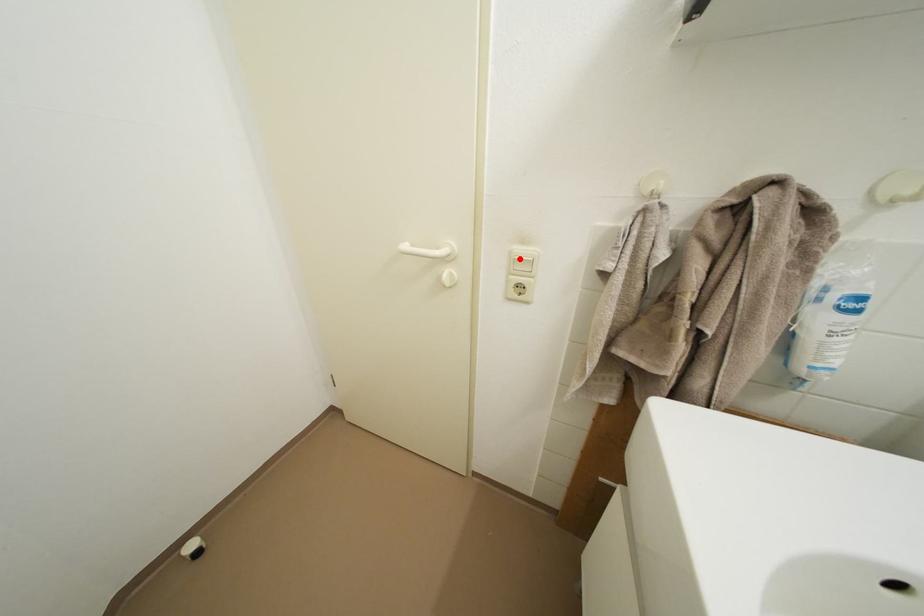
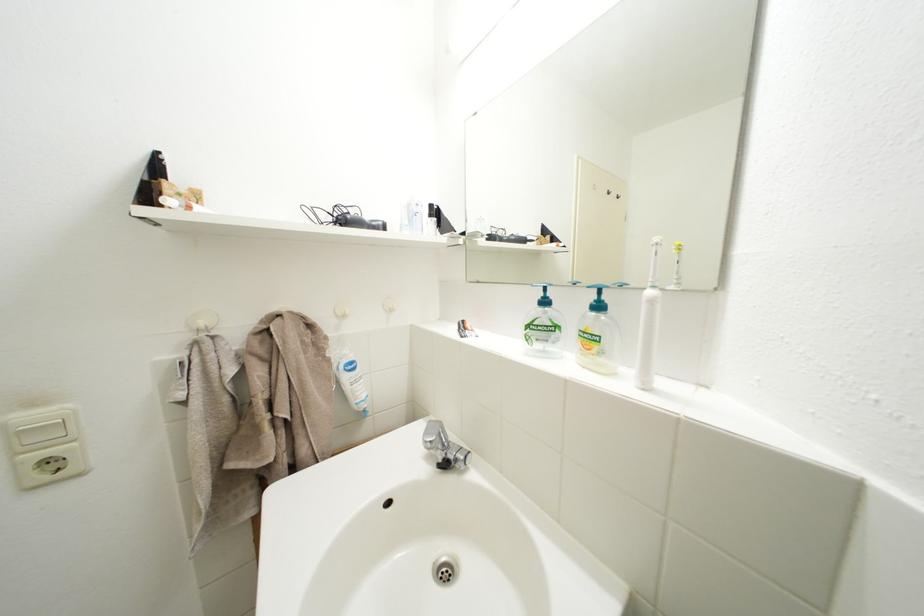
The point at the highlighted location is marked in the first image. Where is the corresponding point in the second image?

(14, 432)